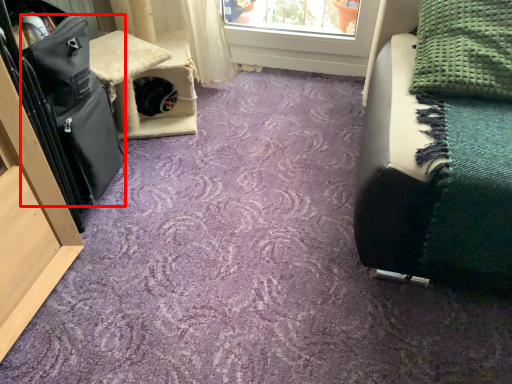
Question: From the image's perspective, what is the correct spatial relationship of luggage (annotated by the red box) in relation to blanket?

Choices:
 (A) above
 (B) below

Answer: (B)